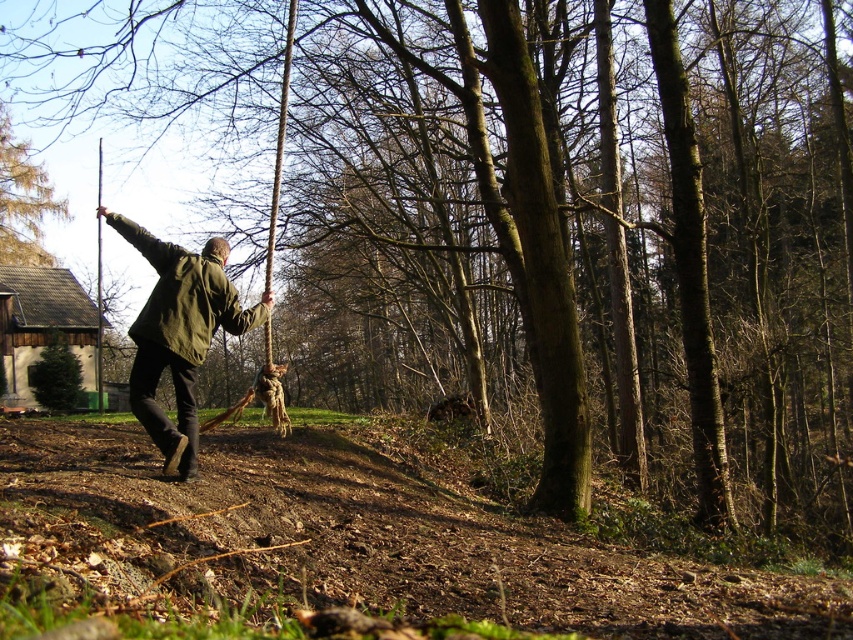
You are standing at point A located at coordinates point A is at point (166, 436). You want to walk to point B, which is 19.35 feet away from point A. Considering the terrain described in the scene, which includes scattered twigs and leaves, would you expect the path between the two points to be easy or difficult to traverse?

The path between point A at point (166, 436) and point B is 19.35 feet apart. The terrain includes scattered twigs and leaves, which could make the path uneven and potentially difficult to traverse, especially over a distance of nearly 20 feet.

You are trying to locate the green matte jacket at center in the image. According to the coordinates provided, where exactly is it positioned?

The green matte jacket at center is located at point coordinates of (178, 333).

You are a hiker who needs to decide which item to carry first. Based on their sizes, which one between the green matte jacket at center and the brown rough tree at upper left is bigger?

The green matte jacket at center has a larger size compared to the brown rough tree at upper left, so you should carry the green matte jacket at center first since it is bigger.